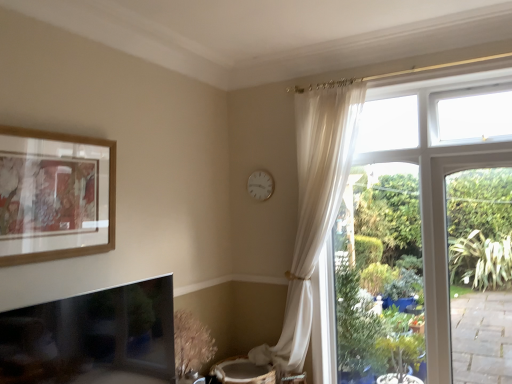
Question: From a real-world perspective, is white plastic clock at upper center physically above wooden picture frame at upper left?

Choices:
 (A) yes
 (B) no

Answer: (A)

Question: From the image's perspective, is white plastic clock at upper center on wooden picture frame at upper left?

Choices:
 (A) yes
 (B) no

Answer: (A)

Question: Is white plastic clock at upper center looking in the opposite direction of wooden picture frame at upper left?

Choices:
 (A) yes
 (B) no

Answer: (B)

Question: Can you confirm if white plastic clock at upper center is positioned to the right of wooden picture frame at upper left?

Choices:
 (A) yes
 (B) no

Answer: (A)

Question: From the image's perspective, is white plastic clock at upper center located beneath wooden picture frame at upper left?

Choices:
 (A) no
 (B) yes

Answer: (A)

Question: Is white plastic clock at upper center far away from wooden picture frame at upper left?

Choices:
 (A) no
 (B) yes

Answer: (B)

Question: Is wooden picture frame at upper left positioned with its back to white plastic clock at upper center?

Choices:
 (A) no
 (B) yes

Answer: (A)

Question: Is wooden picture frame at upper left next to white plastic clock at upper center?

Choices:
 (A) yes
 (B) no

Answer: (B)

Question: Could white plastic clock at upper center be considered to be inside wooden picture frame at upper left?

Choices:
 (A) yes
 (B) no

Answer: (B)

Question: Considering the relative positions of wooden picture frame at upper left and white plastic clock at upper center in the image provided, is wooden picture frame at upper left to the left of white plastic clock at upper center from the viewer's perspective?

Choices:
 (A) yes
 (B) no

Answer: (A)

Question: Does wooden picture frame at upper left lie in front of white plastic clock at upper center?

Choices:
 (A) yes
 (B) no

Answer: (A)

Question: Is wooden picture frame at upper left shorter than white plastic clock at upper center?

Choices:
 (A) no
 (B) yes

Answer: (A)

Question: Is point (257, 195) closer or farther from the camera than point (24, 254)?

Choices:
 (A) closer
 (B) farther

Answer: (B)